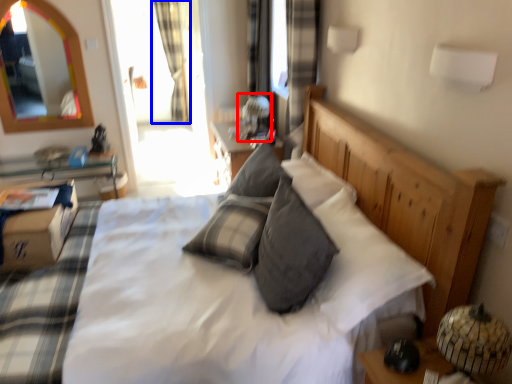
Question: Which object is closer to the camera taking this photo, table lamp (highlighted by a red box) or curtain (highlighted by a blue box)?

Choices:
 (A) table lamp
 (B) curtain

Answer: (A)